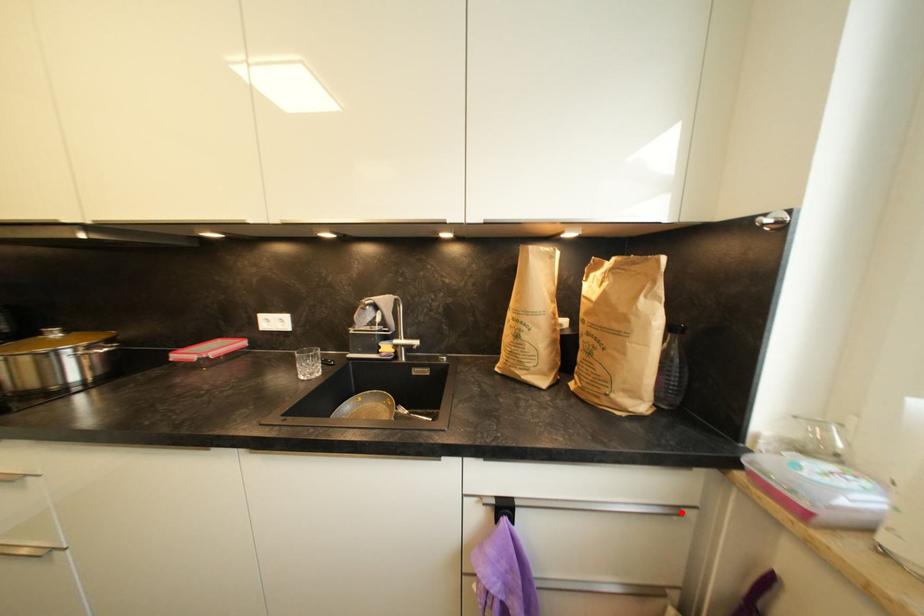
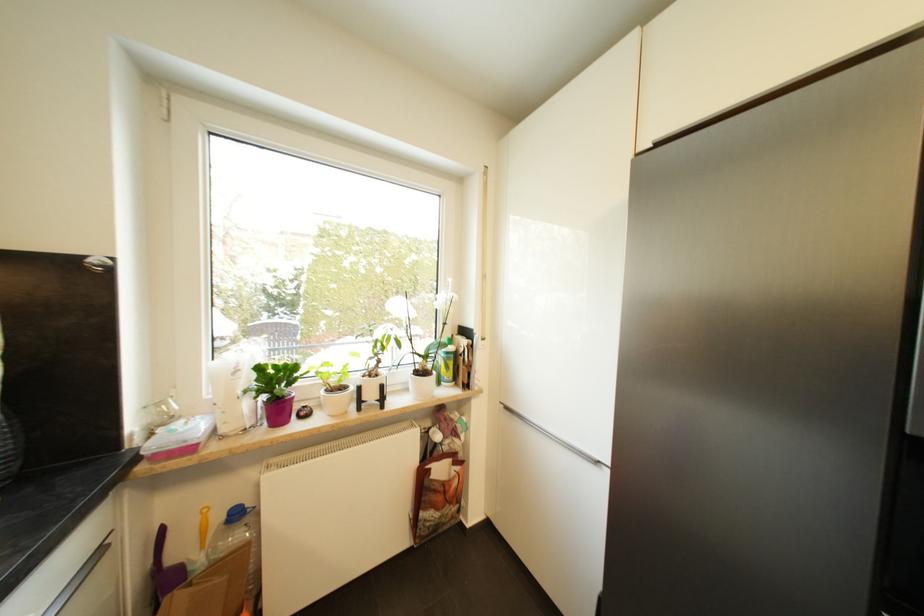
Find the pixel in the second image that matches the highlighted location in the first image.

(105, 553)